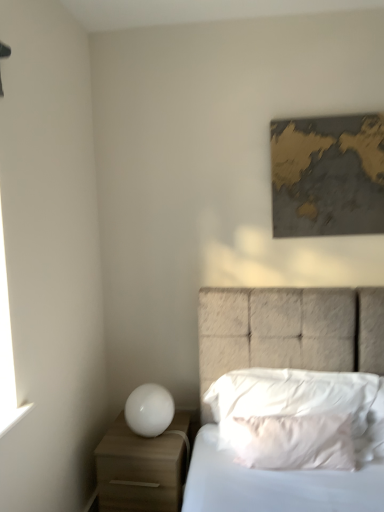
Identify the location of vacant area situated below white glossy sphere at lower left (from a real-world perspective). This screenshot has height=512, width=384. (147, 436).